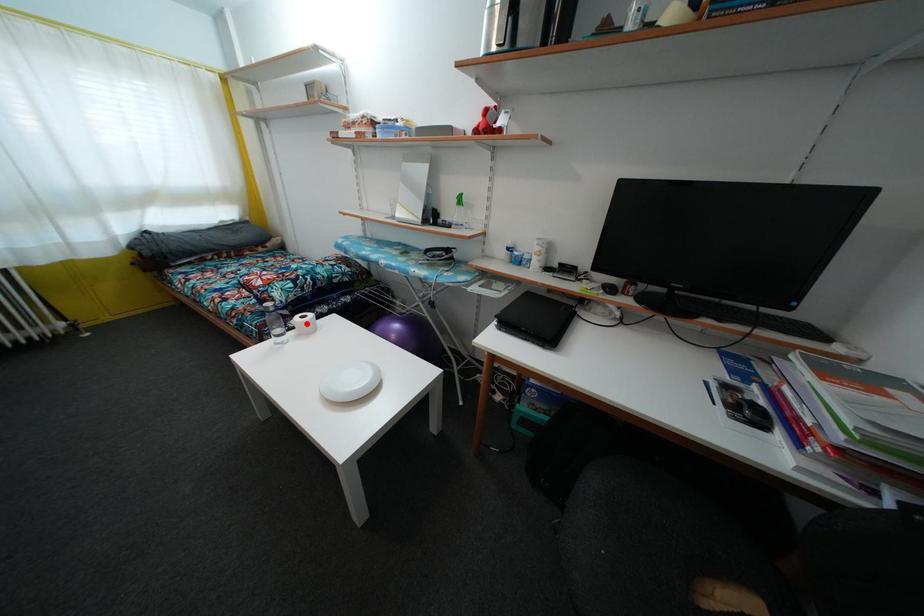
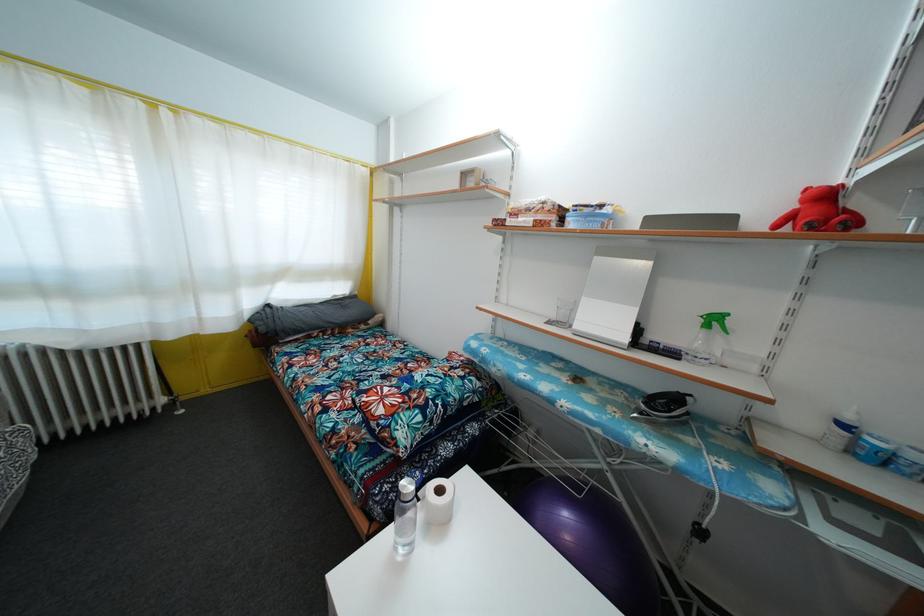
Where in the second image is the point corresponding to the highlighted location from the first image?

(444, 498)